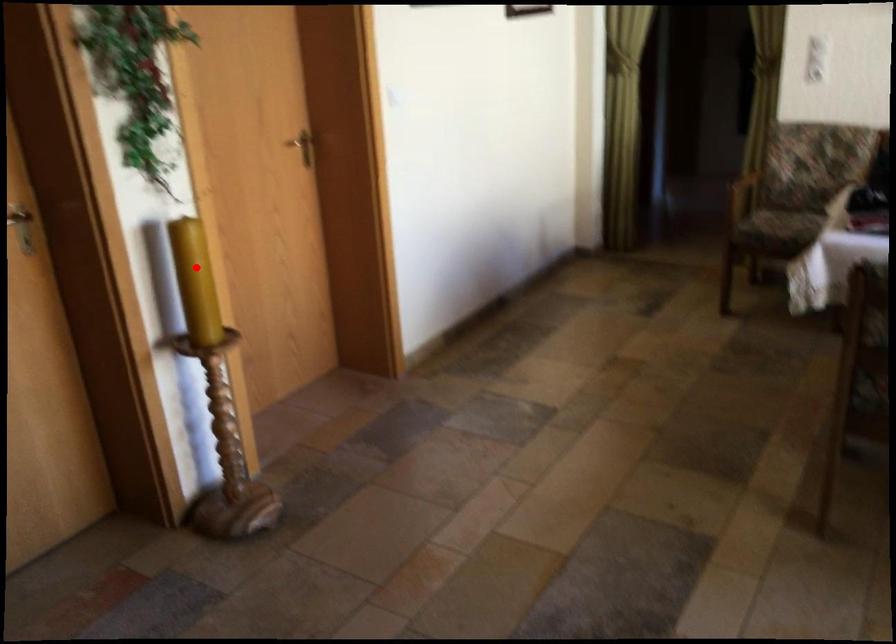
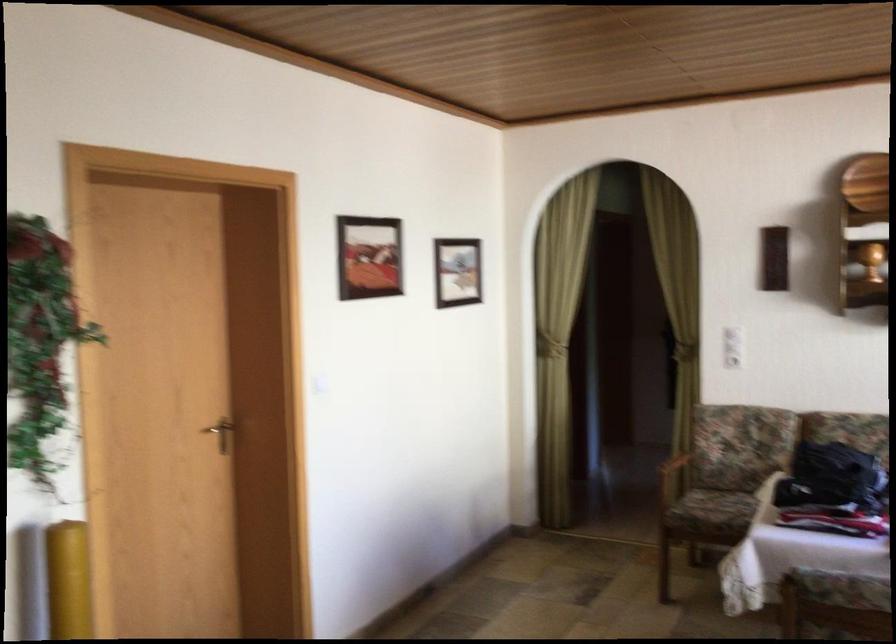
Question: I am providing you with two images of the same scene from different viewpoints. A red point is marked on the first image. Can you still see the location of the red point in image 2?

Choices:
 (A) Yes
 (B) No

Answer: (A)